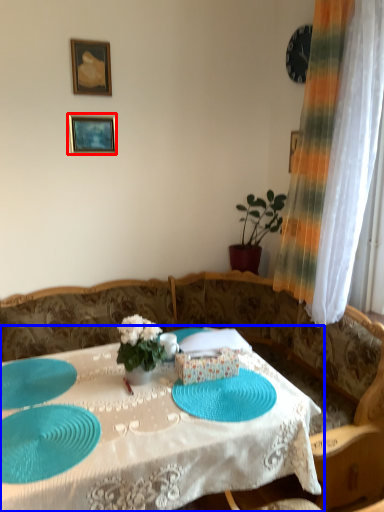
Question: Which object is closer to the camera taking this photo, picture frame (highlighted by a red box) or table (highlighted by a blue box)?

Choices:
 (A) picture frame
 (B) table

Answer: (B)